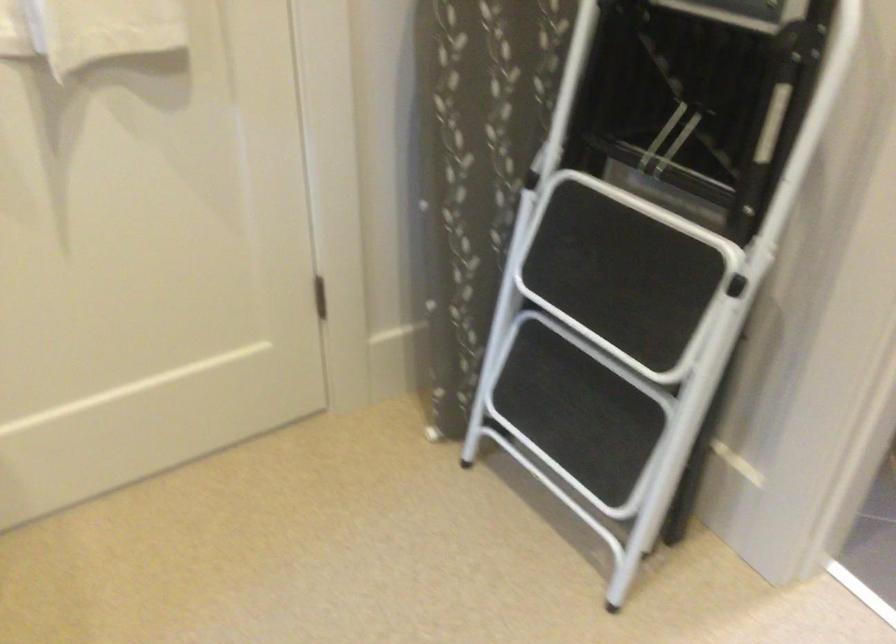
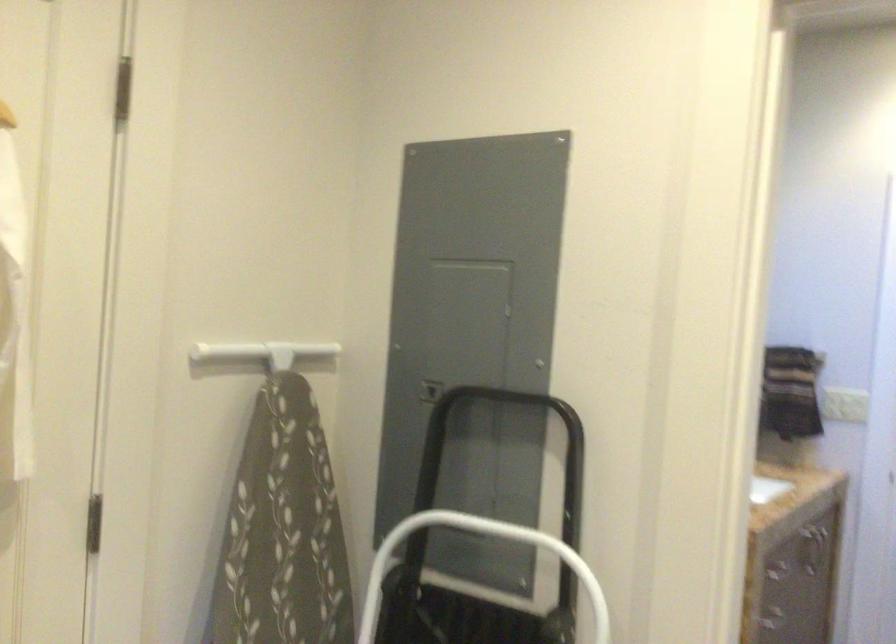
The images are taken continuously from a first-person perspective. In which direction is your viewpoint rotating?

The camera's rotation is toward right-up.